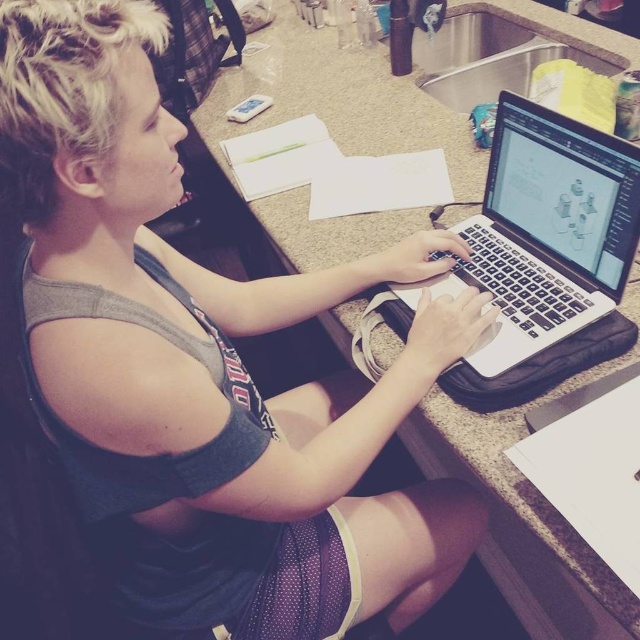
Does point (435, 424) lie in front of point (621, 164)?

No, it is not.

Which is above, granite gray counter top at center or satin black laptop at center?

granite gray counter top at center is above.

Is point (493, 435) positioned in front of point (556, 132)?

Yes.

The image size is (640, 640). Identify the location of granite gray counter top at center. (330, 134).